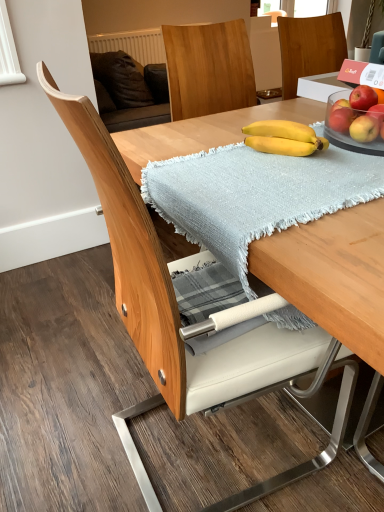
Question: Would you consider wooden chair at center to be distant from matte yellow apple at right, the fourth apple viewed from the top?

Choices:
 (A) yes
 (B) no

Answer: (B)

Question: Can you confirm if wooden chair at center is taller than matte yellow apple at right, which ranks as the 1th apple in bottom-to-top order?

Choices:
 (A) no
 (B) yes

Answer: (B)

Question: Would you say wooden chair at center is outside matte yellow apple at right, the fourth apple viewed from the top?

Choices:
 (A) yes
 (B) no

Answer: (A)

Question: Does wooden chair at center appear on the right side of matte yellow apple at right, the fourth apple viewed from the top?

Choices:
 (A) yes
 (B) no

Answer: (B)

Question: From the image's perspective, is wooden chair at center above matte yellow apple at right, which ranks as the 1th apple in bottom-to-top order?

Choices:
 (A) no
 (B) yes

Answer: (A)

Question: From the image's perspective, is red matte apple at upper right, which is the 4th apple in bottom-to-top order, located above or below matte yellow apple at right, which ranks as the 1th apple in bottom-to-top order?

Choices:
 (A) below
 (B) above

Answer: (B)

Question: Is red matte apple at upper right, arranged as the first apple when viewed from the top, inside the boundaries of matte yellow apple at right, which ranks as the 1th apple in bottom-to-top order, or outside?

Choices:
 (A) outside
 (B) inside

Answer: (A)

Question: Considering the positions of red matte apple at upper right, arranged as the first apple when viewed from the top, and matte yellow apple at right, which ranks as the 1th apple in bottom-to-top order, in the image, is red matte apple at upper right, arranged as the first apple when viewed from the top, taller or shorter than matte yellow apple at right, which ranks as the 1th apple in bottom-to-top order,?

Choices:
 (A) tall
 (B) short

Answer: (A)

Question: Is point (360, 92) positioned closer to the camera than point (357, 136)?

Choices:
 (A) farther
 (B) closer

Answer: (A)

Question: Considering the positions of red matte apple at upper right, the second apple from the top, and red matte apple at upper right, acting as the second apple starting from the bottom, in the image, is red matte apple at upper right, the second apple from the top, taller or shorter than red matte apple at upper right, acting as the second apple starting from the bottom,?

Choices:
 (A) short
 (B) tall

Answer: (A)

Question: Considering their positions, is red matte apple at upper right, the second apple from the top, located in front of or behind red matte apple at upper right, acting as the second apple starting from the bottom?

Choices:
 (A) front
 (B) behind

Answer: (A)

Question: Is red matte apple at upper right, the second apple from the top, inside or outside of red matte apple at upper right, acting as the second apple starting from the bottom?

Choices:
 (A) inside
 (B) outside

Answer: (B)

Question: Considering the positions of red matte apple at upper right, the second apple from the top, and red matte apple at upper right, the 3th apple in the top-to-bottom sequence, in the image, is red matte apple at upper right, the second apple from the top, wider or thinner than red matte apple at upper right, the 3th apple in the top-to-bottom sequence,?

Choices:
 (A) thin
 (B) wide

Answer: (B)

Question: Considering the positions of red matte apple at upper right, acting as the second apple starting from the bottom, and red matte apple at upper right, the second apple from the top, in the image, is red matte apple at upper right, acting as the second apple starting from the bottom, taller or shorter than red matte apple at upper right, the second apple from the top,?

Choices:
 (A) tall
 (B) short

Answer: (A)

Question: Based on their positions, is red matte apple at upper right, acting as the second apple starting from the bottom, located to the left or right of red matte apple at upper right, the second apple from the top?

Choices:
 (A) right
 (B) left

Answer: (B)